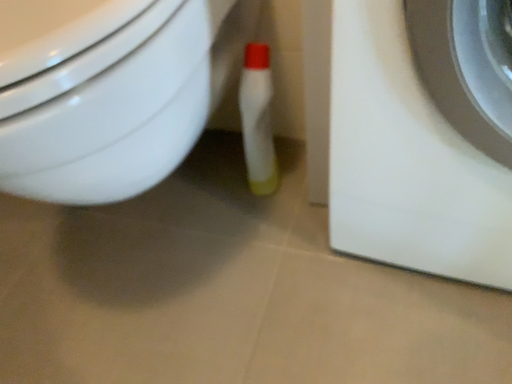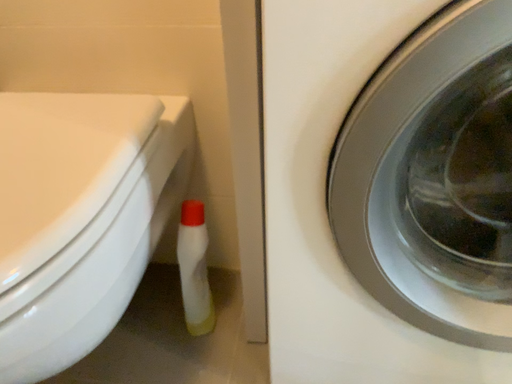
Question: Which way did the camera rotate in the video?

Choices:
 (A) rotated left
 (B) rotated right

Answer: (B)